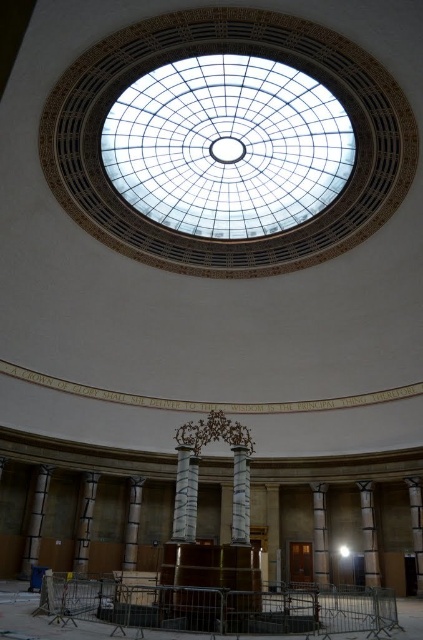
Question: Can you confirm if transparent glass dome at center is smaller than sanded concrete pillar at center?

Choices:
 (A) yes
 (B) no

Answer: (B)

Question: Does transparent glass dome at center have a smaller size compared to white marble column at center?

Choices:
 (A) no
 (B) yes

Answer: (A)

Question: Is white marble column at center thinner than wooden pillar at center?

Choices:
 (A) yes
 (B) no

Answer: (A)

Question: Which point appears farthest from the camera in this image?

Choices:
 (A) (129, 515)
 (B) (419, 497)
 (C) (139, 148)
 (D) (95, 480)

Answer: (A)

Question: Among these points, which one is nearest to the camera?

Choices:
 (A) click(310, 90)
 (B) click(84, 502)
 (C) click(235, 481)
 (D) click(36, 554)

Answer: (C)

Question: Which of these objects is positioned farthest from the slate stone column at center?

Choices:
 (A) sanded wood pillar at right
 (B) sanded concrete pillar at center

Answer: (B)